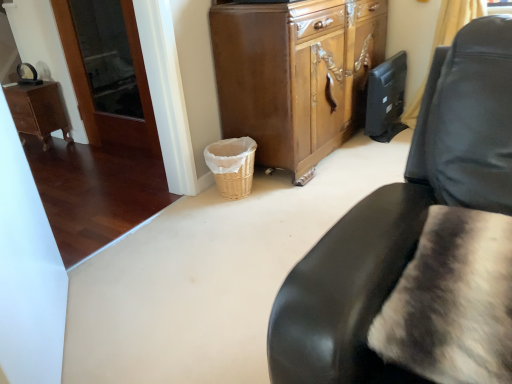
Question: Considering the positions of fuzzy fur pillow at lower right and yellow fabric curtain at upper right in the image, is fuzzy fur pillow at lower right taller or shorter than yellow fabric curtain at upper right?

Choices:
 (A) short
 (B) tall

Answer: (A)

Question: Is fuzzy fur pillow at lower right in front of or behind yellow fabric curtain at upper right in the image?

Choices:
 (A) front
 (B) behind

Answer: (A)

Question: Considering the real-world distances, which object is farthest from the wooden desk at left?

Choices:
 (A) yellow fabric curtain at upper right
 (B) fuzzy fur pillow at lower right
 (C) woven wicker basket at lower center
 (D) wooden cabinet at center

Answer: (B)

Question: Estimate the real-world distances between objects in this image. Which object is farther from the fuzzy fur pillow at lower right?

Choices:
 (A) yellow fabric curtain at upper right
 (B) wooden desk at left
 (C) woven wicker basket at lower center
 (D) wooden cabinet at center

Answer: (B)